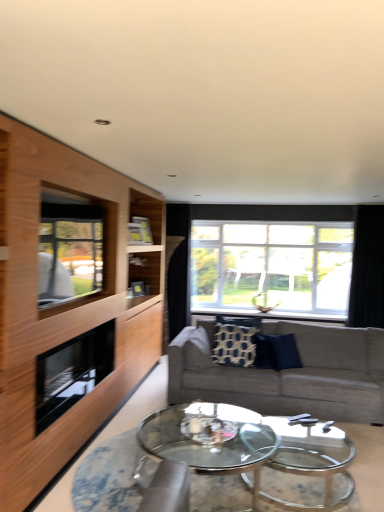
Question: Considering the relative sizes of clear glass window at center, which ranks as the second window in left-to-right order, and clear glass window at left, arranged as the first window when viewed from the left, in the image provided, is clear glass window at center, which ranks as the second window in left-to-right order, bigger than clear glass window at left, arranged as the first window when viewed from the left,?

Choices:
 (A) no
 (B) yes

Answer: (B)

Question: Is clear glass window at center, marked as the 1th window in a back-to-front arrangement, turned away from clear glass window at left, which is the 2th window from right to left?

Choices:
 (A) no
 (B) yes

Answer: (A)

Question: Is clear glass window at center, which ranks as the second window in left-to-right order, not inside clear glass window at left, placed as the 2th window when sorted from back to front?

Choices:
 (A) yes
 (B) no

Answer: (A)

Question: Is the position of clear glass window at center, which ranks as the first window in right-to-left order, more distant than that of clear glass window at left, which is the 2th window from right to left?

Choices:
 (A) yes
 (B) no

Answer: (A)

Question: Can you confirm if clear glass window at center, marked as the 1th window in a back-to-front arrangement, is smaller than clear glass window at left, arranged as the first window when viewed from the left?

Choices:
 (A) no
 (B) yes

Answer: (A)

Question: Considering the positions of wooden cabinet at left and clear glass window at center, which ranks as the first window in right-to-left order, in the image, is wooden cabinet at left taller or shorter than clear glass window at center, which ranks as the first window in right-to-left order,?

Choices:
 (A) short
 (B) tall

Answer: (B)

Question: Looking at their shapes, would you say wooden cabinet at left is wider or thinner than clear glass window at center, the second window when ordered from front to back?

Choices:
 (A) wide
 (B) thin

Answer: (A)

Question: Considering the positions of wooden cabinet at left and clear glass window at center, which ranks as the first window in right-to-left order, in the image, is wooden cabinet at left bigger or smaller than clear glass window at center, which ranks as the first window in right-to-left order,?

Choices:
 (A) small
 (B) big

Answer: (B)

Question: Is wooden cabinet at left inside or outside of clear glass window at center, which ranks as the second window in left-to-right order?

Choices:
 (A) inside
 (B) outside

Answer: (B)

Question: Considering the positions of point (233, 348) and point (279, 361), is point (233, 348) closer or farther from the camera than point (279, 361)?

Choices:
 (A) closer
 (B) farther

Answer: (B)

Question: Is patterned fabric pillow at center, which is the 1th pillow in left-to-right order, spatially inside dark blue fabric pillow at center, which appears as the first pillow when viewed from the right, or outside of it?

Choices:
 (A) inside
 (B) outside

Answer: (B)

Question: From a real-world perspective, is patterned fabric pillow at center, placed as the second pillow when sorted from right to left, physically located above or below dark blue fabric pillow at center, which appears as the first pillow when viewed from the right?

Choices:
 (A) below
 (B) above

Answer: (B)

Question: Is patterned fabric pillow at center, placed as the second pillow when sorted from right to left, bigger or smaller than dark blue fabric pillow at center, which appears as the first pillow when viewed from the right?

Choices:
 (A) small
 (B) big

Answer: (B)

Question: From the image's perspective, is textured gray couch at center located above or below wooden cabinet at left?

Choices:
 (A) above
 (B) below

Answer: (B)

Question: In the image, is textured gray couch at center positioned in front of or behind wooden cabinet at left?

Choices:
 (A) front
 (B) behind

Answer: (B)